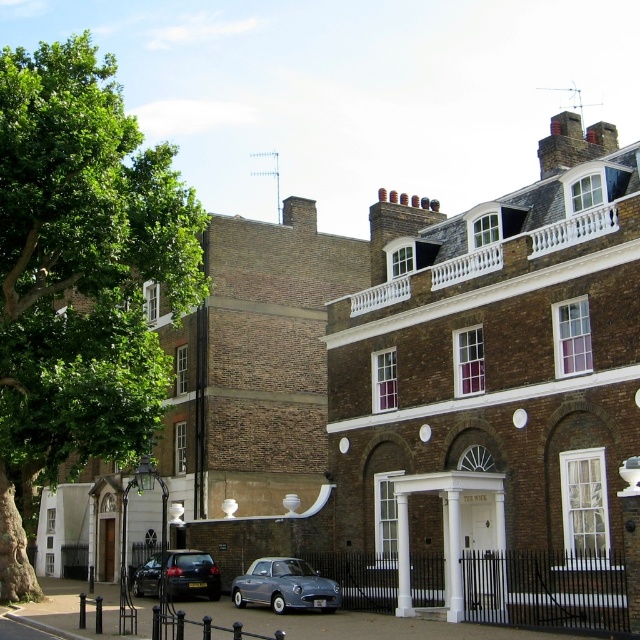
The height and width of the screenshot is (640, 640). Describe the element at coordinates (284, 586) in the screenshot. I see `metallic blue car at center` at that location.

Between metallic blue car at center and matte black car at center, which one is positioned lower?

Positioned lower is matte black car at center.

What are the coordinates of `metallic blue car at center` in the screenshot? It's located at (284, 586).

Does green leafy tree at left come in front of matte black car at center?

That is True.

Is green leafy tree at left to the right of matte black car at center from the viewer's perspective?

No, green leafy tree at left is not to the right of matte black car at center.

What do you see at coordinates (80, 275) in the screenshot? I see `green leafy tree at left` at bounding box center [80, 275].

You are a GUI agent. You are given a task and a screenshot of the screen. Output one action in this format:
    pyautogui.click(x=<x>, y=<y>)
    Task: Click on the green leafy tree at left
    
    Given the screenshot: What is the action you would take?
    pyautogui.click(x=80, y=275)

Does green leafy tree at left have a smaller size compared to metallic blue car at center?

No, green leafy tree at left is not smaller than metallic blue car at center.

Is green leafy tree at left above metallic blue car at center?

Indeed, green leafy tree at left is positioned over metallic blue car at center.

Does point (184, 240) come behind point (323, 611)?

Yes, point (184, 240) is behind point (323, 611).

You are a GUI agent. You are given a task and a screenshot of the screen. Output one action in this format:
    pyautogui.click(x=<x>, y=<y>)
    Task: Click on the green leafy tree at left
    The height and width of the screenshot is (640, 640).
    Given the screenshot: What is the action you would take?
    pyautogui.click(x=80, y=275)